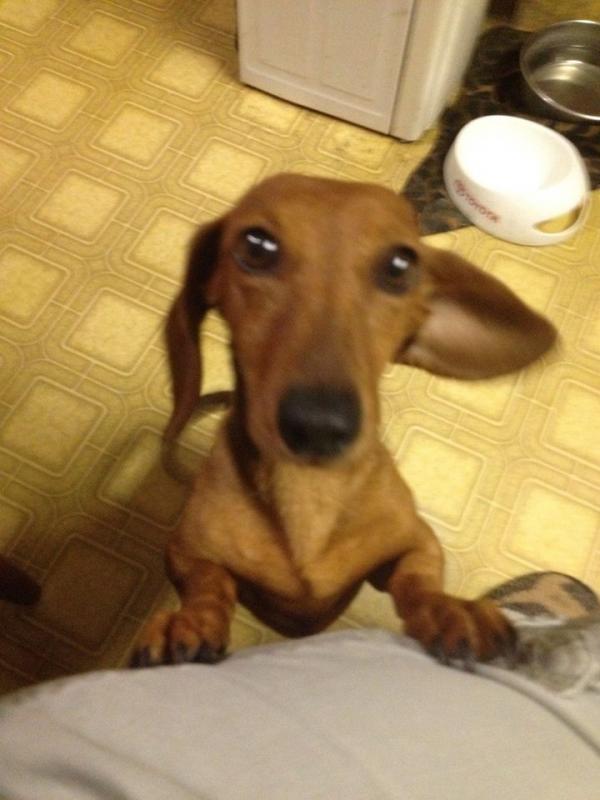
Locate an element on the screen. The width and height of the screenshot is (600, 800). white cabnet is located at coordinates (380, 88).